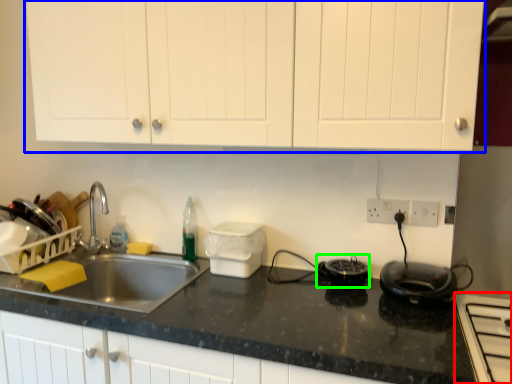
Question: Which is nearer to the home appliance (highlighted by a red box)? cabinetry (highlighted by a blue box) or appliance (highlighted by a green box).

Choices:
 (A) cabinetry
 (B) appliance

Answer: (B)